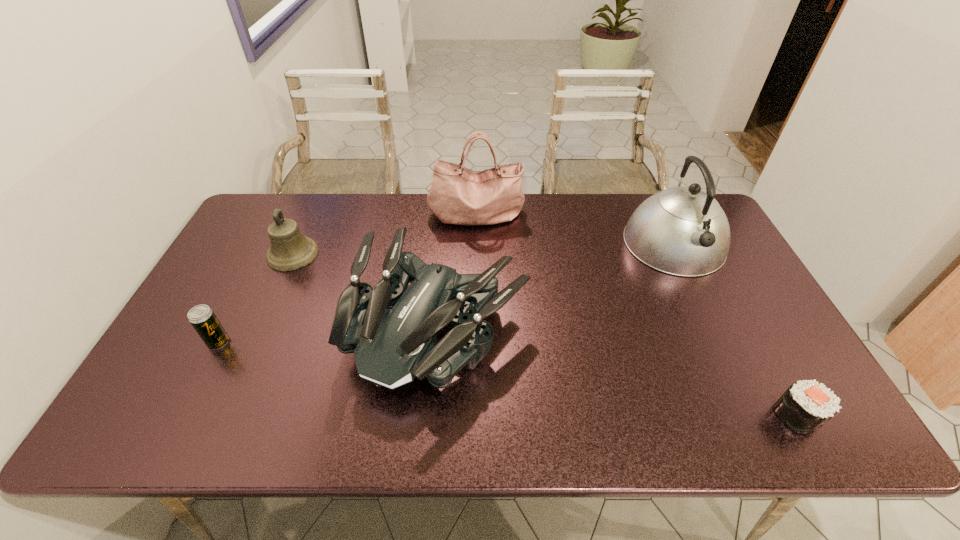
Locate an element on the screen. handbag is located at coordinates (458, 195).

You are a GUI agent. You are given a task and a screenshot of the screen. Output one action in this format:
    pyautogui.click(x=<x>, y=<y>)
    Task: Click on the kettle
    
    Given the screenshot: What is the action you would take?
    pyautogui.click(x=683, y=231)

What are the coordinates of `bell` in the screenshot? It's located at tap(290, 250).

Locate an element on the screen. drone is located at coordinates [x=392, y=330].

Where is `the fifth tallest object`? The height and width of the screenshot is (540, 960). the fifth tallest object is located at coordinates (202, 317).

The width and height of the screenshot is (960, 540). Find the location of `the shortest object`. the shortest object is located at coordinates (806, 405).

At what (x,y) coordinates should I click in order to perform the action: click on blank space located 0.330m at the front of the handbag with handles. Please return your answer as a coordinate pair (x, y). This screenshot has width=960, height=540. Looking at the image, I should click on (476, 307).

The height and width of the screenshot is (540, 960). In order to click on free space located from the spout of the kettle in this screenshot , I will do `click(706, 309)`.

Locate an element on the screen. free region located 0.280m on the front of the bell is located at coordinates (251, 349).

Find the location of a particular element. This screenshot has width=960, height=540. vacant space located on the left of the drone is located at coordinates (234, 329).